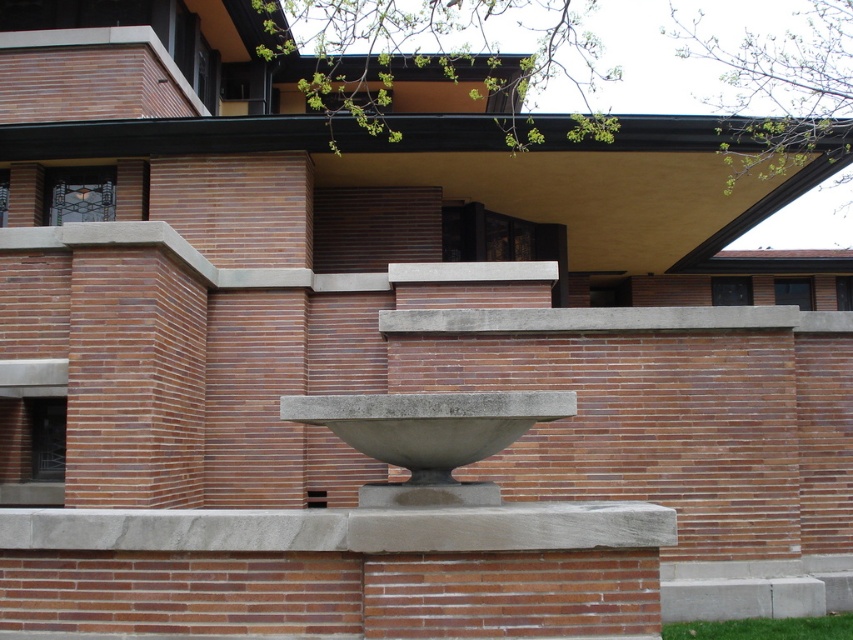
You are standing in front of the building and want to place a small potted plant on the gray concrete ledge at center. What are the exact coordinates where you should place it?

The gray concrete ledge at center is located at coordinates point (344, 529), so you should place the potted plant there.

You are an architect analyzing the building facade. You observe the gray concrete ledge at center and the gray concrete bowl at center. Which of these two elements has a greater height?

The gray concrete bowl at center is taller than the gray concrete ledge at center.

You are standing in front of the building and want to determine which of the two points, point (51, 529) or point (502, 424), is closer to you. Based on the architectural features described, which point is nearer?

Point (51, 529) is closer to the viewer than point (502, 424).